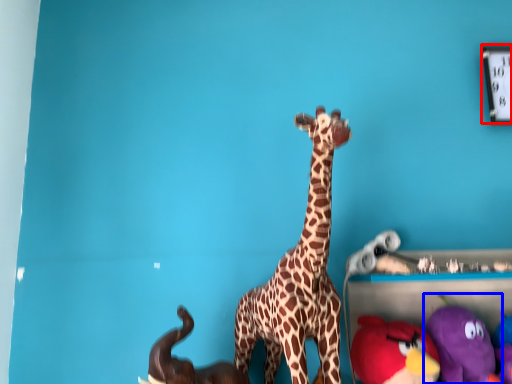
Question: Among these objects, which one is farthest to the camera, clock (highlighted by a red box) or toy (highlighted by a blue box)?

Choices:
 (A) clock
 (B) toy

Answer: (A)